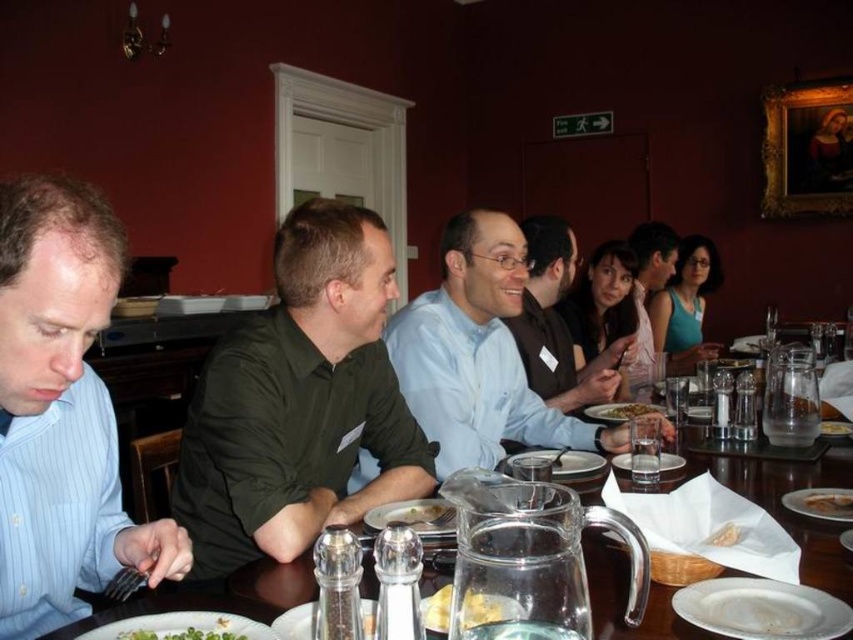
Can you confirm if light blue shirt at center is bigger than clear glass pitcher at center?

Indeed, light blue shirt at center has a larger size compared to clear glass pitcher at center.

Does light blue shirt at center appear over clear glass pitcher at center?

Yes, light blue shirt at center is above clear glass pitcher at center.

Locate an element on the screen. The width and height of the screenshot is (853, 640). light blue shirt at center is located at coordinates (479, 355).

Which of these two, matte blue shirt at center or yellow crumbly bread at center, stands shorter?

yellow crumbly bread at center is shorter.

Is point (581, 376) more distant than point (483, 609)?

That is True.

Image resolution: width=853 pixels, height=640 pixels. I want to click on matte blue shirt at center, so [556, 323].

Can you confirm if matte blue shirt at center is wider than white creamy pasta at center?

Yes.

You are a GUI agent. You are given a task and a screenshot of the screen. Output one action in this format:
    pyautogui.click(x=<x>, y=<y>)
    Task: Click on the matte blue shirt at center
    This screenshot has width=853, height=640.
    Given the screenshot: What is the action you would take?
    pyautogui.click(x=556, y=323)

Image resolution: width=853 pixels, height=640 pixels. In order to click on matte blue shirt at center in this screenshot , I will do `click(556, 323)`.